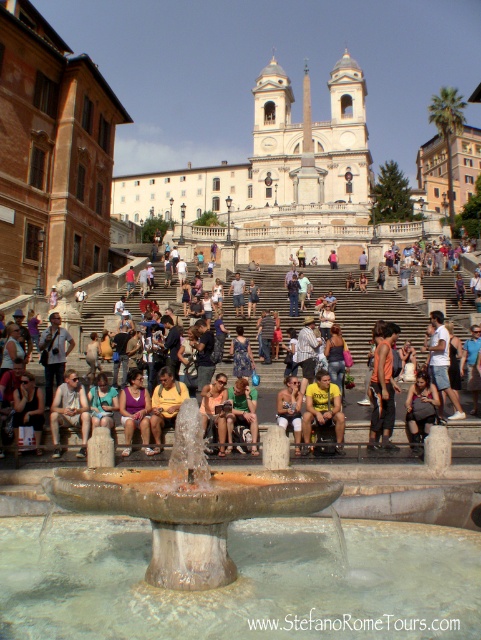
You are standing at the Spanish Steps in Rome and see two points marked on the steps. The first point is at coordinate (134, 506) and the second is at (342, 426). If you want to walk from the first point to the second point, which direction should you move relative to the steps?

You should move towards the back of the steps because point (134, 506) is in front of point (342, 426). To reach the second point, you need to walk backward along the steps.

You are a tourist standing at the Spanish Steps and want to take a photo of both the stone fountain at center and the orange fabric shirt at center. Since you want both to be clearly visible in the photo, which object should you focus on to ensure the smaller one is also in frame?

The stone fountain at center is bigger than the orange fabric shirt at center, so you should focus on the orange fabric shirt at center to ensure both are clearly visible in the photo.

You are standing at the Spanish Steps in Rome, and you want to take a photo of the point at coordinates (115, 493). If your camera has a focal length of 50mm and you are 26.68 meters away from the point, what is the angle of view required to capture the entire point in your photo?

The angle of view required to capture the entire point at coordinates (115, 493) from 26.68 meters away with a 50mm focal length can be calculated using the formula for angle of view. However, without knowing the size of the point, an exact calculation isn